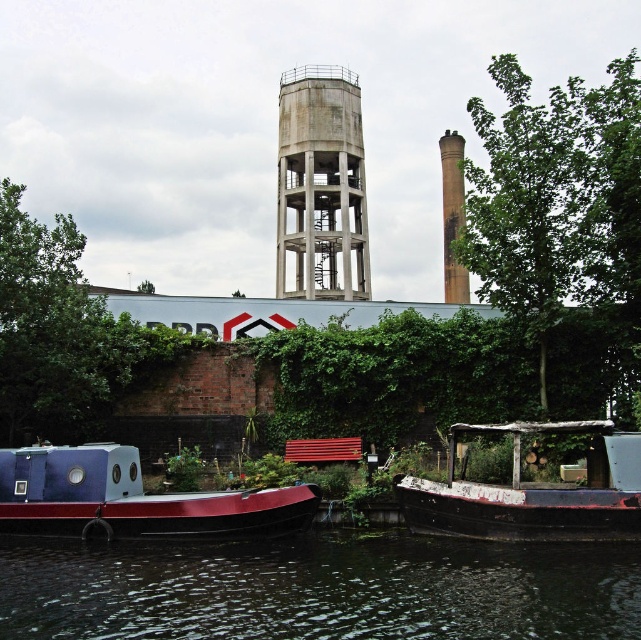
You are standing on the riverside path and see the red polished wood boat at lower left and the concrete water tower at center. Which object is closer to your left side?

The red polished wood boat at lower left is closer to your left side since it is positioned to the left of the concrete water tower at center.